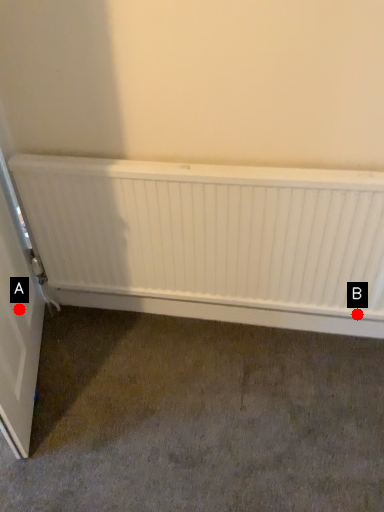
Question: Two points are circled on the image, labeled by A and B beside each circle. Which point is closer to the camera?

Choices:
 (A) A is closer
 (B) B is closer

Answer: (A)